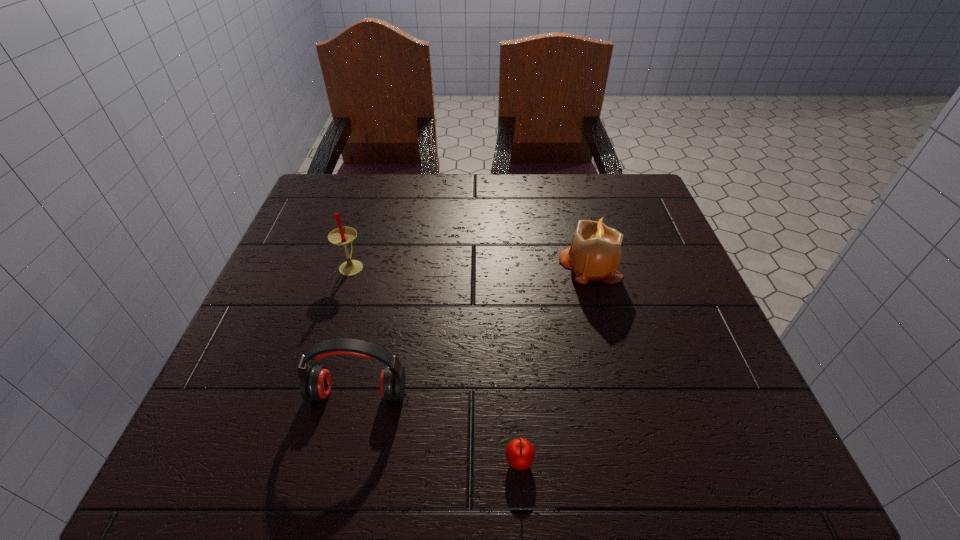
The image size is (960, 540). I want to click on free space that is in between the left candle and the rightmost object, so click(x=470, y=266).

Identify the location of free space between the left candle and the earphone. pos(355,329).

At what (x,y) coordinates should I click in order to perform the action: click on free area in between the left candle and the earphone. Please return your answer as a coordinate pair (x, y). Looking at the image, I should click on (355, 329).

Identify the location of free space between the right candle and the nearest object. The width and height of the screenshot is (960, 540). (553, 363).

Identify the location of object that stands as the third closest to the left candle. (520, 454).

What are the coordinates of `the second closest object to the left candle` in the screenshot? It's located at (594, 255).

What are the coordinates of `vacant area in the image that satisfies the following two spatial constraints: 1. on the back side of the right candle; 2. on the left side of the left candle` in the screenshot? It's located at (352, 266).

What are the coordinates of `vacant point that satisfies the following two spatial constraints: 1. on the ear cups of the third farthest object; 2. on the right side of the second object from right to left` in the screenshot? It's located at (343, 461).

Find the location of `free spot that satisfies the following two spatial constraints: 1. on the ear cups of the second nearest object; 2. on the right side of the shortest object`. free spot that satisfies the following two spatial constraints: 1. on the ear cups of the second nearest object; 2. on the right side of the shortest object is located at coordinates (343, 461).

The image size is (960, 540). I want to click on free point that satisfies the following two spatial constraints: 1. on the back side of the right candle; 2. on the right side of the nearest object, so (504, 266).